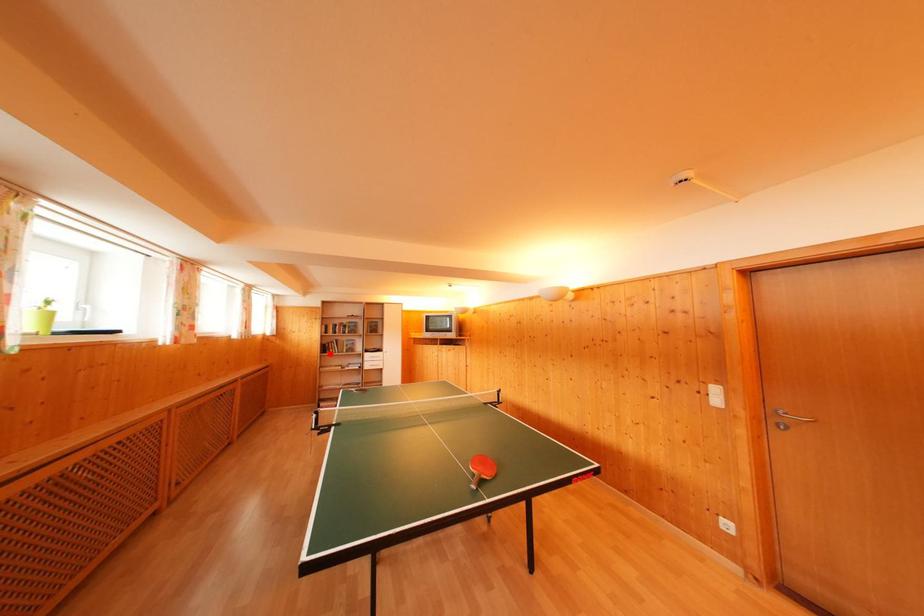
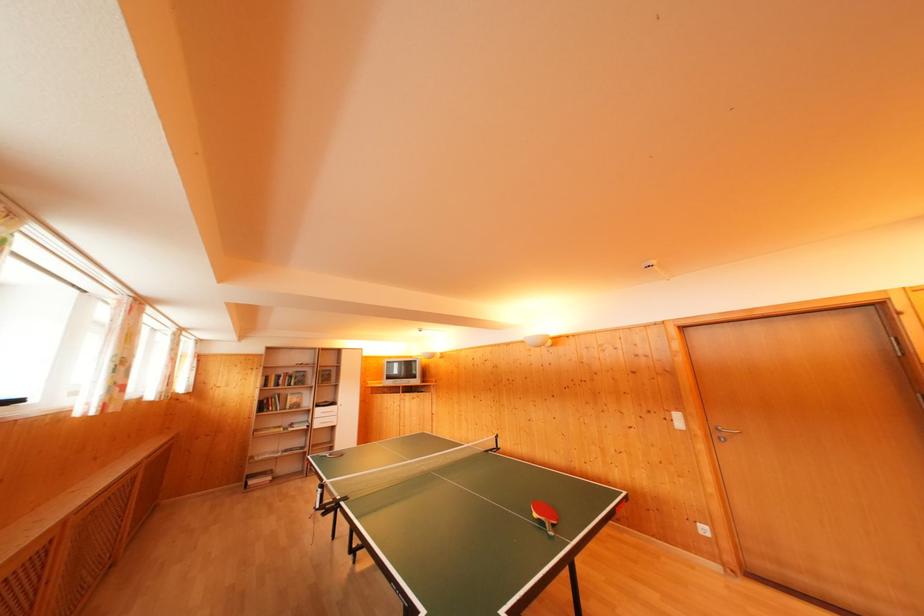
In the second image, find the point that corresponds to the highlighted location in the first image.

(268, 411)